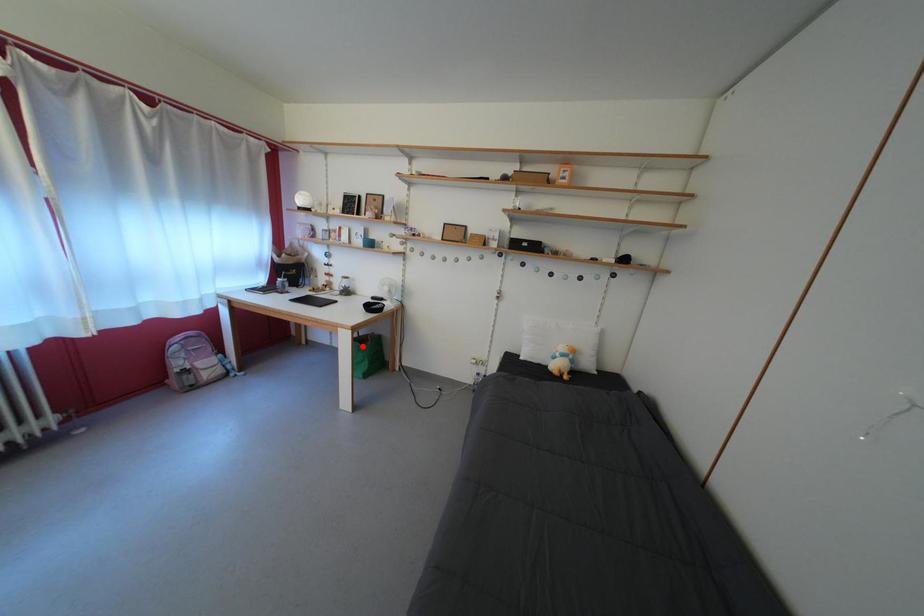
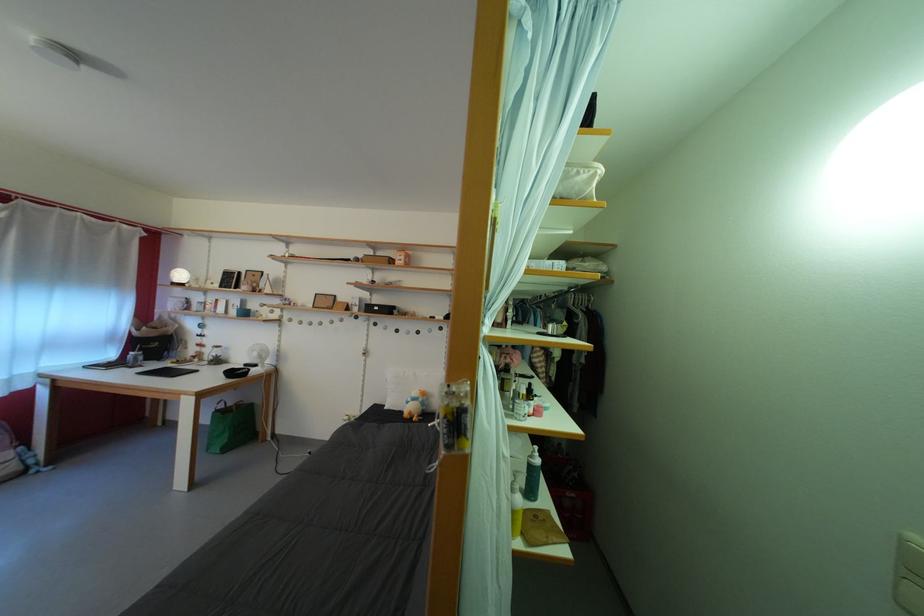
In the second image, find the point that corresponds to the highlighted location in the first image.

(225, 416)